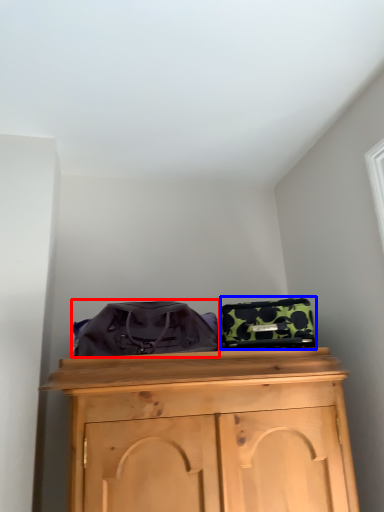
Question: Which point is closer to the camera, messenger bag (highlighted by a red box) or luggage (highlighted by a blue box)?

Choices:
 (A) messenger bag
 (B) luggage

Answer: (A)